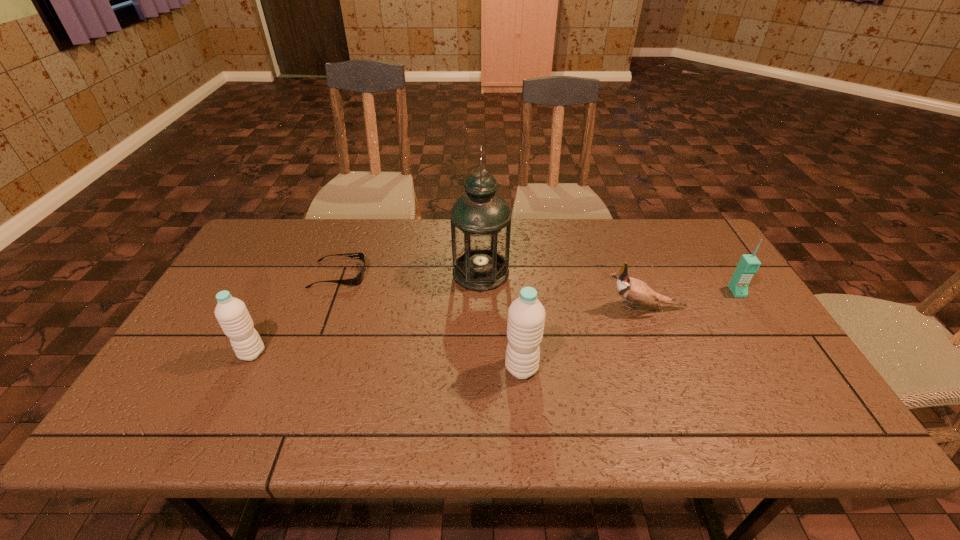
In order to click on the shorter water bottle in this screenshot , I will do `click(231, 313)`.

Find the location of a particular element. the left water bottle is located at coordinates (231, 313).

Where is `the taller water bottle`? the taller water bottle is located at coordinates (526, 315).

Find the location of a particular element. This screenshot has width=960, height=540. the right water bottle is located at coordinates (526, 315).

At what (x,y) coordinates should I click in order to perform the action: click on sunglasses. Please return your answer as a coordinate pair (x, y). This screenshot has width=960, height=540. Looking at the image, I should click on (357, 280).

Find the location of a particular element. The image size is (960, 540). the fifth object from right to left is located at coordinates pyautogui.click(x=357, y=280).

The height and width of the screenshot is (540, 960). What are the coordinates of `cellular telephone` in the screenshot? It's located at click(x=749, y=264).

Where is `the fifth object from left to right`? Image resolution: width=960 pixels, height=540 pixels. the fifth object from left to right is located at coordinates (633, 290).

Locate an element on the screen. Image resolution: width=960 pixels, height=540 pixels. bird is located at coordinates (633, 290).

In order to click on oil lamp in this screenshot , I will do `click(480, 220)`.